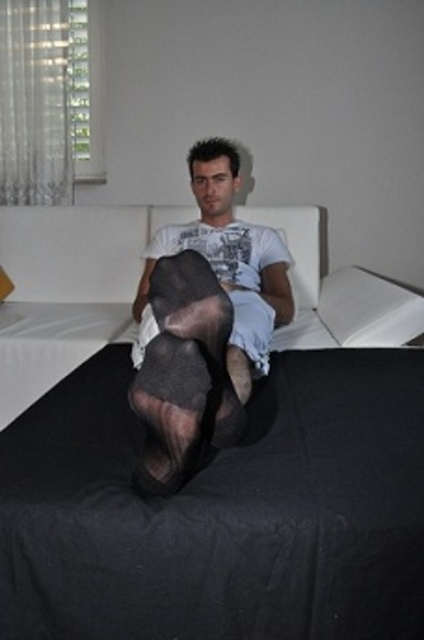
Question: Estimate the real-world distances between objects in this image. Which object is closer to the matte black tights at center?

Choices:
 (A) black fabric bed at center
 (B) black sheer stocking at center
 (C) white fabric pillow at upper right

Answer: (B)

Question: Based on their relative distances, which object is nearer to the black sheer stocking at center?

Choices:
 (A) white fabric pillow at upper right
 (B) matte black tights at center
 (C) black fabric bed at center

Answer: (B)

Question: Is matte black tights at center closer to the viewer compared to black sheer stocking at center?

Choices:
 (A) yes
 (B) no

Answer: (B)

Question: Which point appears closest to the camera in this image?

Choices:
 (A) (11, 554)
 (B) (184, 300)

Answer: (A)

Question: Is matte black tights at center smaller than white fabric pillow at upper right?

Choices:
 (A) no
 (B) yes

Answer: (A)

Question: Where is black fabric bed at center located in relation to black sheer stocking at center in the image?

Choices:
 (A) left
 (B) right

Answer: (B)